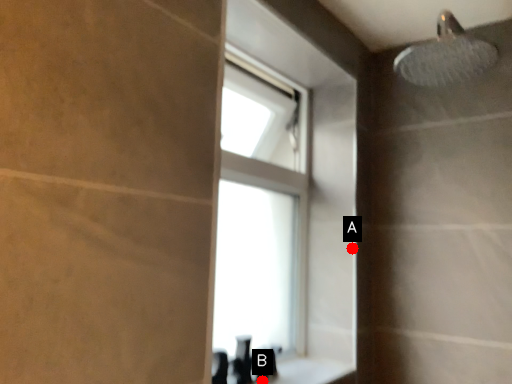
Question: Two points are circled on the image, labeled by A and B beside each circle. Which point is closer to the camera?

Choices:
 (A) A is closer
 (B) B is closer

Answer: (B)